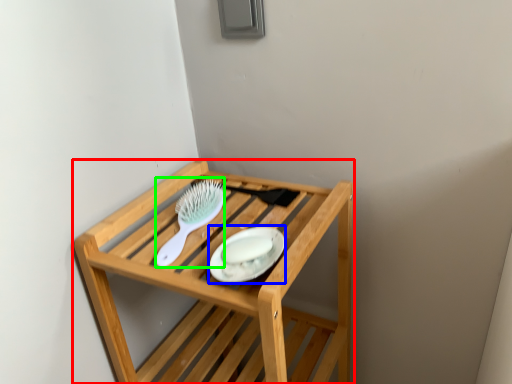
Question: Which is farther away from furniture (highlighted by a red box)? platter (highlighted by a blue box) or brush (highlighted by a green box)?

Choices:
 (A) platter
 (B) brush

Answer: (A)